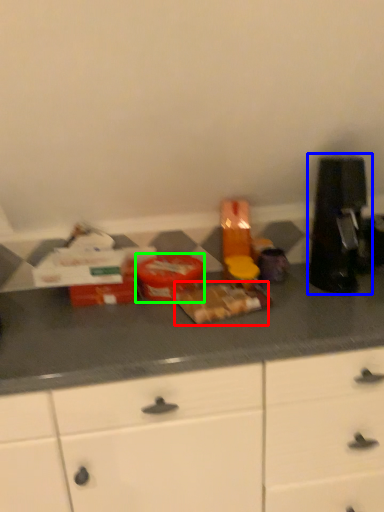
Question: Estimate the real-world distances between objects in this image. Which object is farther from food (highlighted by a red box), coffee machine (highlighted by a blue box) or food (highlighted by a green box)?

Choices:
 (A) coffee machine
 (B) food

Answer: (A)